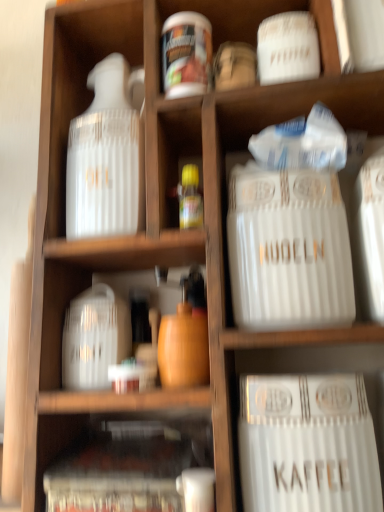
Image resolution: width=384 pixels, height=512 pixels. Describe the element at coordinates (106, 157) in the screenshot. I see `white glossy jar at left` at that location.

This screenshot has width=384, height=512. In order to click on white plastic container at center, which ranks as the first cabinet in top-to-bottom order in this screenshot , I will do `click(90, 286)`.

What is the approximate width of white ceramic canister at center right?

white ceramic canister at center right is 15.55 centimeters wide.

You are a GUI agent. You are given a task and a screenshot of the screen. Output one action in this format:
    pyautogui.click(x=<x>, y=<y>)
    Task: Click on the white glossy jar at upper center
    
    Given the screenshot: What is the action you would take?
    pyautogui.click(x=186, y=54)

The width and height of the screenshot is (384, 512). What are the coordinates of `translucent plastic container at lower left, which appears as the second cabinet when viewed from the top` in the screenshot? It's located at (129, 465).

You are a GUI agent. You are given a task and a screenshot of the screen. Output one action in this format:
    pyautogui.click(x=<x>, y=<y>)
    Task: Click on the white glossy jar at left
    
    Given the screenshot: What is the action you would take?
    pyautogui.click(x=106, y=157)

Considering the relative positions of translucent plastic container at lower left, which ranks as the 1th cabinet in bottom-to-top order, and white plastic container at center, the second cabinet from the bottom, in the image provided, is translucent plastic container at lower left, which ranks as the 1th cabinet in bottom-to-top order, to the right of white plastic container at center, the second cabinet from the bottom, from the viewer's perspective?

Yes.

Which object is thinner, translucent plastic container at lower left, which ranks as the 1th cabinet in bottom-to-top order, or white plastic container at center, which ranks as the first cabinet in top-to-bottom order?

Thinner between the two is translucent plastic container at lower left, which ranks as the 1th cabinet in bottom-to-top order.

From the image's perspective, which one is positioned lower, translucent plastic container at lower left, which ranks as the 1th cabinet in bottom-to-top order, or white plastic container at center, the second cabinet from the bottom?

translucent plastic container at lower left, which ranks as the 1th cabinet in bottom-to-top order.

The width and height of the screenshot is (384, 512). In order to click on cabinet in front of the white plastic container at center, the second cabinet from the bottom in this screenshot , I will do `click(129, 465)`.

Is white glossy jar at upper center inside the boundaries of white glossy jar at left, or outside?

white glossy jar at upper center is spatially situated outside white glossy jar at left.

Which of these two, white glossy jar at upper center or white glossy jar at left, stands shorter?

With less height is white glossy jar at upper center.

In the image, is white glossy jar at upper center positioned in front of or behind white glossy jar at left?

Visually, white glossy jar at upper center is located behind white glossy jar at left.

Is white glossy jar at upper center positioned with its back to white glossy jar at left?

white glossy jar at upper center does not have its back to white glossy jar at left.

Which object is positioned more to the left, white glossy jar at upper center or white plastic container at center, the second cabinet from the bottom?

white plastic container at center, the second cabinet from the bottom, is more to the left.

Is white glossy jar at upper center surrounding white plastic container at center, which ranks as the first cabinet in top-to-bottom order?

No, white plastic container at center, which ranks as the first cabinet in top-to-bottom order, is not inside white glossy jar at upper center.

From a real-world perspective, is white glossy jar at upper center located beneath white plastic container at center, the second cabinet from the bottom?

No, from a real-world perspective, white glossy jar at upper center is not beneath white plastic container at center, the second cabinet from the bottom.

Find the location of a particular element. The image size is (384, 512). type above the white plastic container at center, the second cabinet from the bottom (from a real-world perspective) is located at coordinates (288, 250).

From the image's perspective, is white plastic container at center, which ranks as the first cabinet in top-to-bottom order, positioned above or below white ceramic canister at center right?

white plastic container at center, which ranks as the first cabinet in top-to-bottom order, is situated lower than white ceramic canister at center right in the image.

Is white plastic container at center, which ranks as the first cabinet in top-to-bottom order, taller than white ceramic canister at center right?

In fact, white plastic container at center, which ranks as the first cabinet in top-to-bottom order, may be shorter than white ceramic canister at center right.

Considering the positions of objects white plastic container at center, the second cabinet from the bottom, and white ceramic canister at center right in the image provided, who is in front, white plastic container at center, the second cabinet from the bottom, or white ceramic canister at center right?

white ceramic canister at center right.

From the image's perspective, is white glossy jar at left located above or below translucent plastic container at lower left, which appears as the second cabinet when viewed from the top?

From the image's perspective, white glossy jar at left appears above translucent plastic container at lower left, which appears as the second cabinet when viewed from the top.

Does point (133, 125) appear closer or farther from the camera than point (134, 463)?

Clearly, point (133, 125) is more distant from the camera than point (134, 463).

Choose the correct answer: Is white glossy jar at left inside translucent plastic container at lower left, which appears as the second cabinet when viewed from the top, or outside it?

white glossy jar at left cannot be found inside translucent plastic container at lower left, which appears as the second cabinet when viewed from the top.

Who is taller, white glossy jar at left or translucent plastic container at lower left, which ranks as the 1th cabinet in bottom-to-top order?

white glossy jar at left is taller.

How many degrees apart are the facing directions of translucent plastic container at lower left, which appears as the second cabinet when viewed from the top, and white ceramic canister at center right?

There is a 1.67-degree angle between the facing directions of translucent plastic container at lower left, which appears as the second cabinet when viewed from the top, and white ceramic canister at center right.

Considering the relative sizes of translucent plastic container at lower left, which appears as the second cabinet when viewed from the top, and white ceramic canister at center right in the image provided, is translucent plastic container at lower left, which appears as the second cabinet when viewed from the top, wider than white ceramic canister at center right?

No, translucent plastic container at lower left, which appears as the second cabinet when viewed from the top, is not wider than white ceramic canister at center right.

From a real-world perspective, starting from the white ceramic canister at center right, which cabinet is the 2nd one below it? Please provide its 2D coordinates.

[(129, 465)]

From the image's perspective, is translucent plastic container at lower left, which appears as the second cabinet when viewed from the top, beneath white ceramic canister at center right?

Yes, from the image's perspective, translucent plastic container at lower left, which appears as the second cabinet when viewed from the top, is beneath white ceramic canister at center right.

What are the coordinates of `pottery above the translucent plastic container at lower left, which ranks as the 1th cabinet in bottom-to-top order (from the image's perspective)` in the screenshot? It's located at (186, 54).

Could translucent plastic container at lower left, which ranks as the 1th cabinet in bottom-to-top order, be considered to be inside white glossy jar at upper center?

Definitely not — translucent plastic container at lower left, which ranks as the 1th cabinet in bottom-to-top order, is not inside white glossy jar at upper center.

Considering the positions of points (189, 49) and (180, 429), is point (189, 49) closer to camera compared to point (180, 429)?

Yes, point (189, 49) is in front of point (180, 429).

Where is `cabinet above the translucent plastic container at lower left, which appears as the second cabinet when viewed from the top (from a real-world perspective)`? The height and width of the screenshot is (512, 384). cabinet above the translucent plastic container at lower left, which appears as the second cabinet when viewed from the top (from a real-world perspective) is located at coordinates (90, 286).

The width and height of the screenshot is (384, 512). What are the coordinates of `pottery that appears behind the white glossy jar at left` in the screenshot? It's located at (186, 54).

From the image, which object appears to be farther from white glossy jar at left, white ceramic canister at center right or white plastic container at center, which ranks as the first cabinet in top-to-bottom order?

Based on the image, white ceramic canister at center right appears to be further to white glossy jar at left.

Based on the photo, when comparing their distances from white glossy jar at left, does white glossy jar at upper center or translucent plastic container at lower left, which appears as the second cabinet when viewed from the top, seem closer?

The object closer to white glossy jar at left is white glossy jar at upper center.

From the image, which object appears to be farther from white plastic container at center, which ranks as the first cabinet in top-to-bottom order, white glossy jar at left or white ceramic canister at center right?

white ceramic canister at center right is positioned further to the anchor white plastic container at center, which ranks as the first cabinet in top-to-bottom order.

Estimate the real-world distances between objects in this image. Which object is closer to white ceramic canister at center right, white plastic container at center, which ranks as the first cabinet in top-to-bottom order, or translucent plastic container at lower left, which appears as the second cabinet when viewed from the top?

Among the two, white plastic container at center, which ranks as the first cabinet in top-to-bottom order, is located nearer to white ceramic canister at center right.

Looking at this image, when comparing their distances from translucent plastic container at lower left, which ranks as the 1th cabinet in bottom-to-top order, does white glossy jar at left or white plastic container at center, the second cabinet from the bottom, seem further?

The object further to translucent plastic container at lower left, which ranks as the 1th cabinet in bottom-to-top order, is white glossy jar at left.

Estimate the real-world distances between objects in this image. Which object is further from white glossy jar at left, white ceramic canister at center right or translucent plastic container at lower left, which appears as the second cabinet when viewed from the top?

translucent plastic container at lower left, which appears as the second cabinet when viewed from the top.

Based on their spatial positions, is translucent plastic container at lower left, which ranks as the 1th cabinet in bottom-to-top order, or white ceramic canister at center right further from white glossy jar at upper center?

Among the two, translucent plastic container at lower left, which ranks as the 1th cabinet in bottom-to-top order, is located further to white glossy jar at upper center.

When comparing their distances from white glossy jar at left, does translucent plastic container at lower left, which ranks as the 1th cabinet in bottom-to-top order, or white ceramic canister at center right seem further?

Based on the image, translucent plastic container at lower left, which ranks as the 1th cabinet in bottom-to-top order, appears to be further to white glossy jar at left.

Where is `cabinet between white glossy jar at left and translucent plastic container at lower left, which appears as the second cabinet when viewed from the top, in the up-down direction`? This screenshot has width=384, height=512. cabinet between white glossy jar at left and translucent plastic container at lower left, which appears as the second cabinet when viewed from the top, in the up-down direction is located at coordinates (90, 286).

Where is `pottery between white glossy jar at left and white ceramic canister at center right from left to right`? Image resolution: width=384 pixels, height=512 pixels. pottery between white glossy jar at left and white ceramic canister at center right from left to right is located at coordinates (186, 54).

Locate an element on the screen. cabinet between white glossy jar at upper center and translucent plastic container at lower left, which ranks as the 1th cabinet in bottom-to-top order, in the vertical direction is located at coordinates (90, 286).

Where is `cabinet that lies between white ceramic canister at center right and translucent plastic container at lower left, which ranks as the 1th cabinet in bottom-to-top order, from top to bottom`? The height and width of the screenshot is (512, 384). cabinet that lies between white ceramic canister at center right and translucent plastic container at lower left, which ranks as the 1th cabinet in bottom-to-top order, from top to bottom is located at coordinates (90, 286).